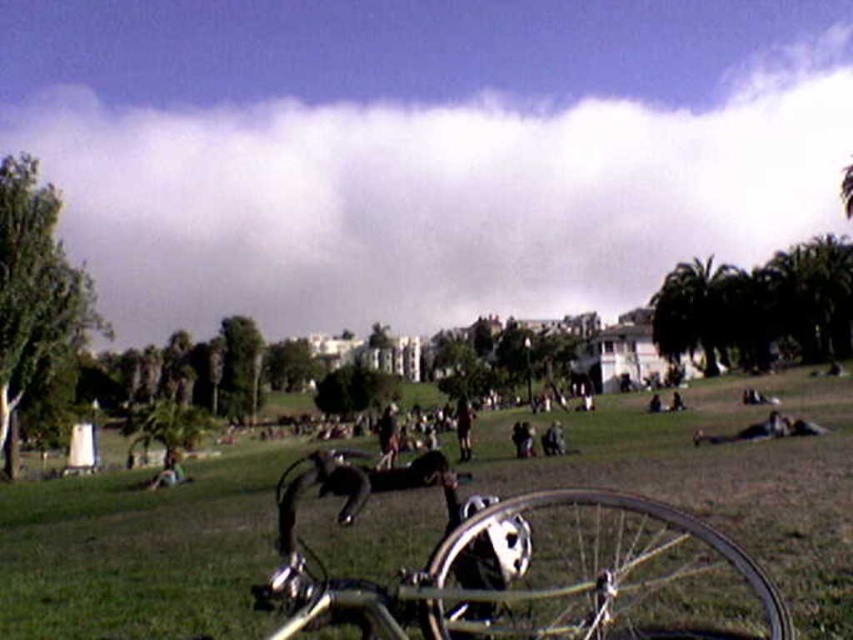
Is shiny metallic bicycle at center shorter than silver metallic bicycle at center?

No.

Which is behind, point (24, 588) or point (619, 515)?

The point (619, 515) is behind.

Find the location of a particular element. shiny metallic bicycle at center is located at coordinates (720, 477).